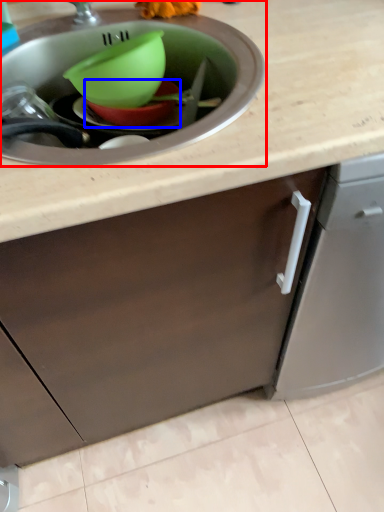
Question: Which point is closer to the camera, sink (highlighted by a red box) or basin (highlighted by a blue box)?

Choices:
 (A) sink
 (B) basin

Answer: (A)